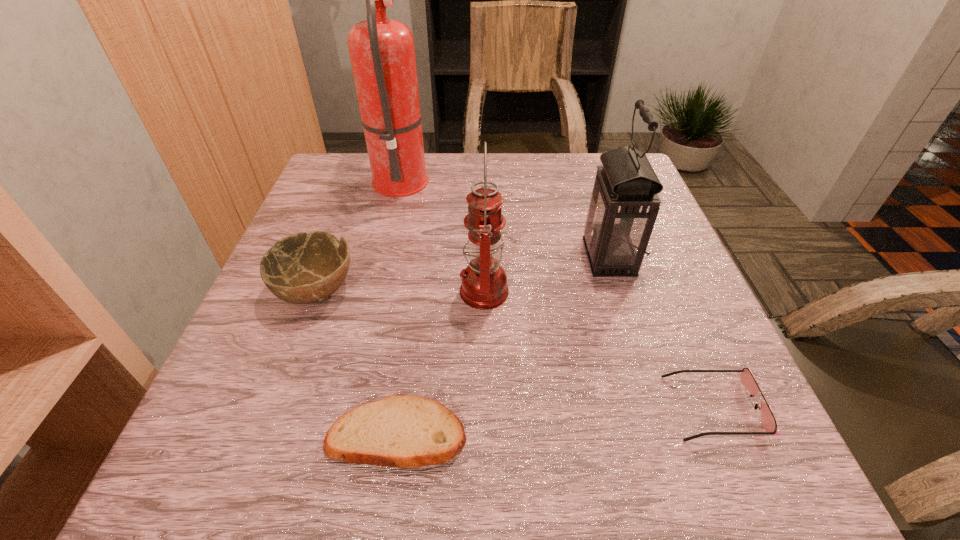
Locate an element on the screen. Image resolution: width=960 pixels, height=540 pixels. vacant space at the near left corner of the desktop is located at coordinates (272, 451).

The image size is (960, 540). In the image, there is a desktop. Identify the location of vacant space at the near right corner. (702, 485).

The width and height of the screenshot is (960, 540). Identify the location of free space that is in between the pita bread and the oil lamp. (441, 362).

Locate an element on the screen. free space between the lantern and the sunglasses is located at coordinates (661, 332).

Locate an element on the screen. empty space between the fire extinguisher and the oil lamp is located at coordinates (443, 234).

You are a GUI agent. You are given a task and a screenshot of the screen. Output one action in this format:
    pyautogui.click(x=<x>, y=<y>)
    Task: Click on the unoccupied area between the bowl and the pita bread
    The height and width of the screenshot is (540, 960).
    Given the screenshot: What is the action you would take?
    pyautogui.click(x=356, y=362)

Locate an element on the screen. vacant space in between the fourth tallest object and the fire extinguisher is located at coordinates (359, 234).

At what (x,y) coordinates should I click in order to perform the action: click on blank region between the lantern and the sunglasses. Please return your answer as a coordinate pair (x, y). The image size is (960, 540). Looking at the image, I should click on (661, 332).

What are the coordinates of `empty location between the pita bread and the fourth tallest object` in the screenshot? It's located at (356, 362).

Where is `empty space between the shortest object and the lantern`? Image resolution: width=960 pixels, height=540 pixels. empty space between the shortest object and the lantern is located at coordinates (502, 346).